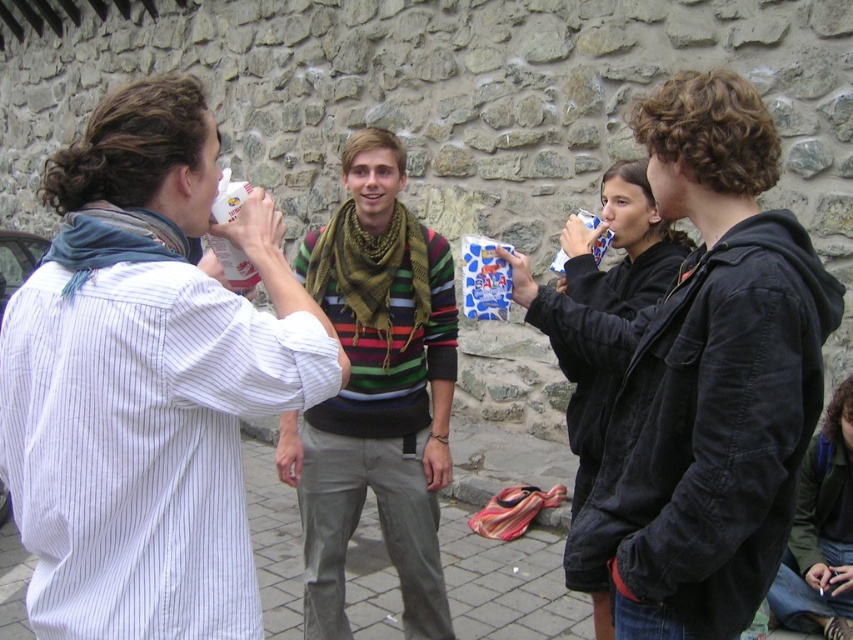
You are organizing a clothing donation drive and need to categorize the dark gray hoodie at right and the black matte jacket at center based on their sizes. Which clothing item is bigger?

The dark gray hoodie at right is larger in size compared to the black matte jacket at center.